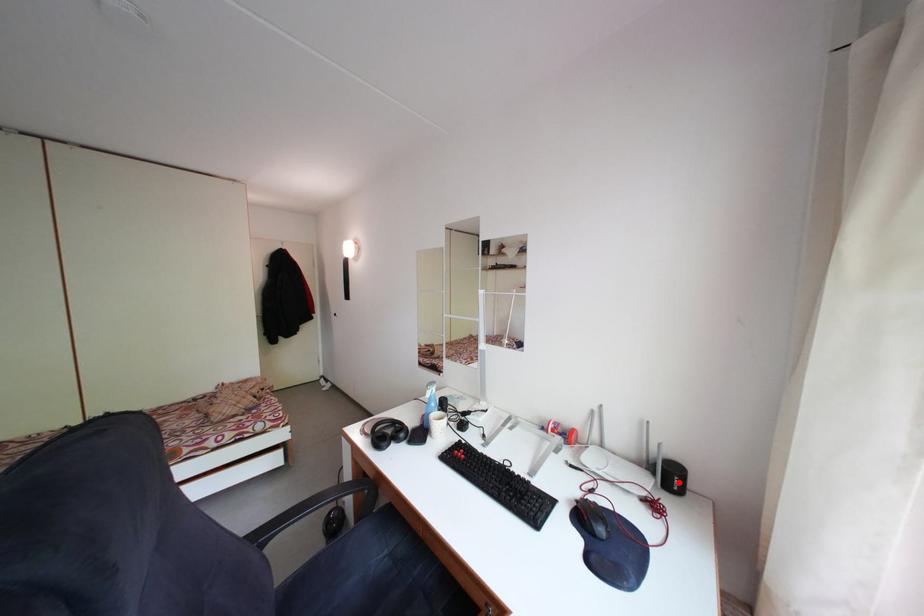
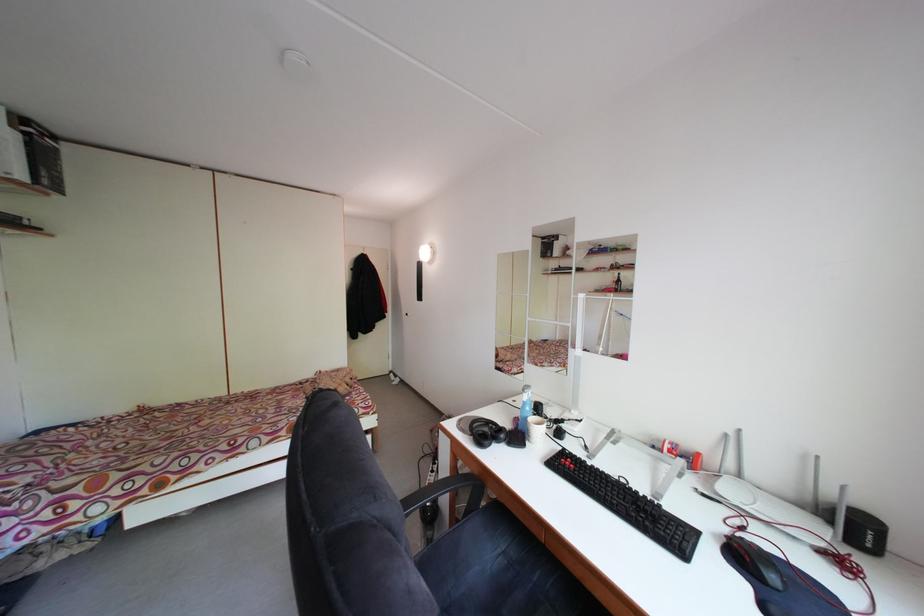
Where in the second image is the point corresponding to the highlighted location from the first image?

(865, 535)